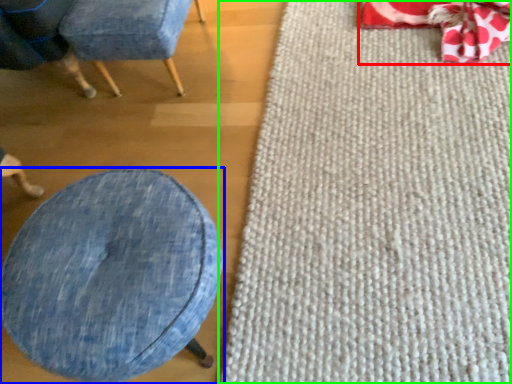
Question: Estimate the real-world distances between objects in this image. Which object is closer to bean bag chair (highlighted by a red box), furniture (highlighted by a blue box) or mat (highlighted by a green box)?

Choices:
 (A) furniture
 (B) mat

Answer: (B)